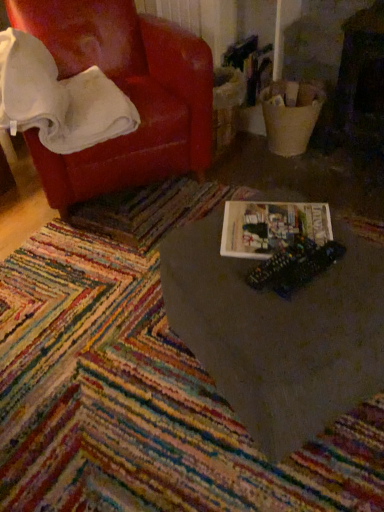
Find the location of a particular element. This screenshot has height=512, width=384. free space in front of hardcover book at center is located at coordinates (295, 302).